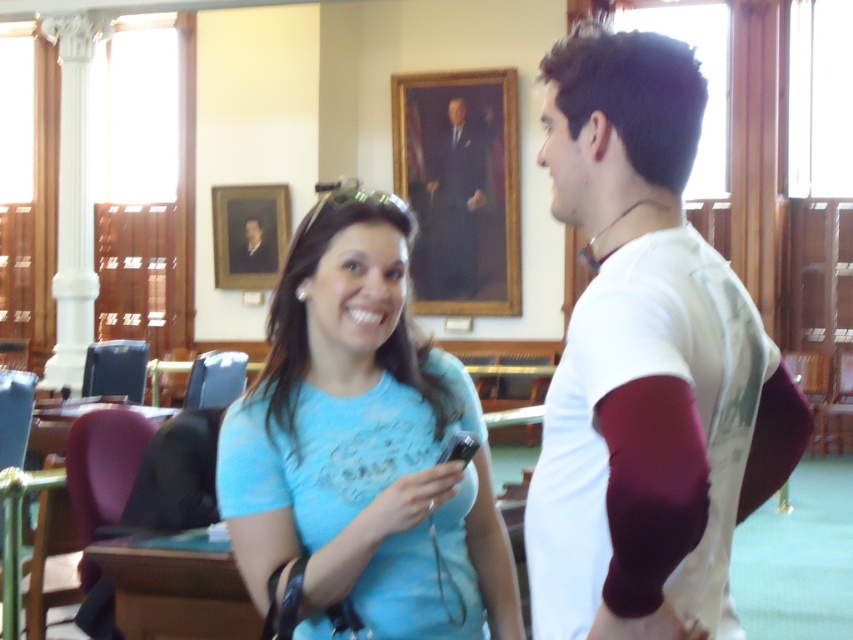
Question: Which point is farther from the camera taking this photo?

Choices:
 (A) (709, 304)
 (B) (444, 236)
 (C) (669, 221)

Answer: (B)

Question: Considering the real-world distances, which object is farthest from the formal suit at center?

Choices:
 (A) matte blue shirt at center
 (B) white cotton t-shirt at center
 (C) blue cotton shirt at center

Answer: (B)

Question: Is white cotton t-shirt at center above formal suit at center?

Choices:
 (A) yes
 (B) no

Answer: (B)

Question: Which object is the closest to the white cotton t-shirt at center?

Choices:
 (A) formal suit at center
 (B) matte blue shirt at center
 (C) blue cotton shirt at center

Answer: (C)

Question: Is blue cotton shirt at center above white cotton t-shirt at center?

Choices:
 (A) no
 (B) yes

Answer: (B)

Question: In this image, where is white cotton t-shirt at center located relative to matte blue shirt at center?

Choices:
 (A) left
 (B) right

Answer: (B)